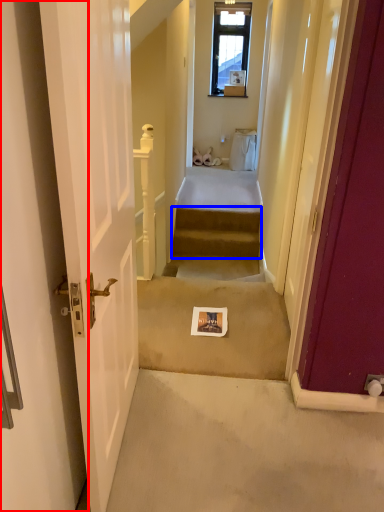
Question: Which object is closer to the camera taking this photo, door (highlighted by a red box) or stairs (highlighted by a blue box)?

Choices:
 (A) door
 (B) stairs

Answer: (A)